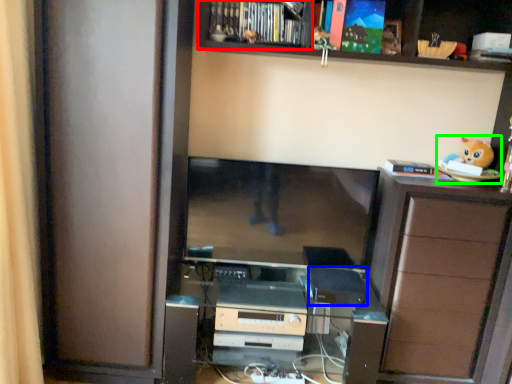
Question: Estimate the real-world distances between objects in this image. Which object is closer to cabinet (highlighted by a red box), appliance (highlighted by a blue box) or toy (highlighted by a green box)?

Choices:
 (A) appliance
 (B) toy

Answer: (B)